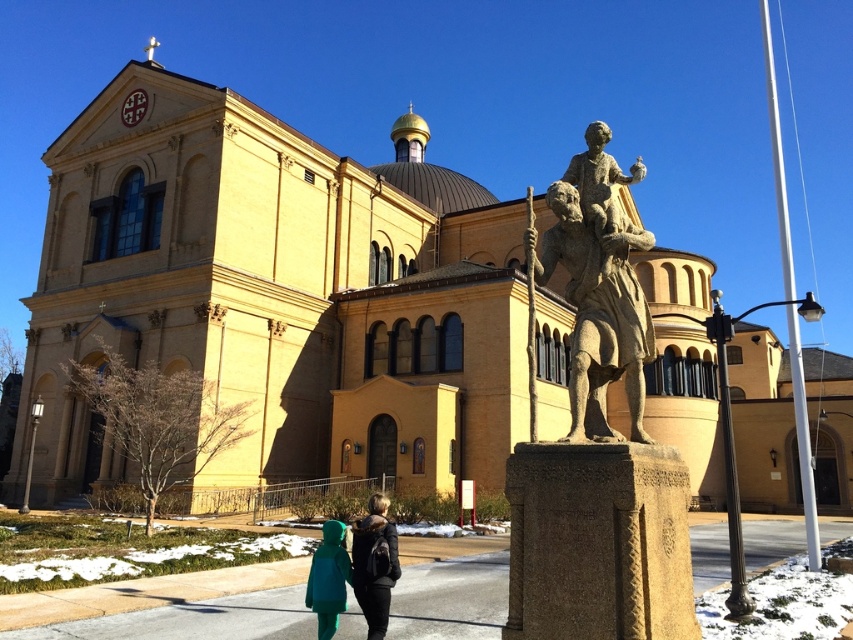
You are a visitor standing in front of the church. You see the stone statue at center and the teal fabric coat at lower left. Which object is taller?

The stone statue at center is taller than the teal fabric coat at lower left.

You are an artist preparing to sketch the scene. You notice two figures in the foreground wearing the teal fabric coat at lower left and the green matte jacket at lower center. Which clothing item has a greater width in the image?

The teal fabric coat at lower left has a greater width than the green matte jacket at lower center.